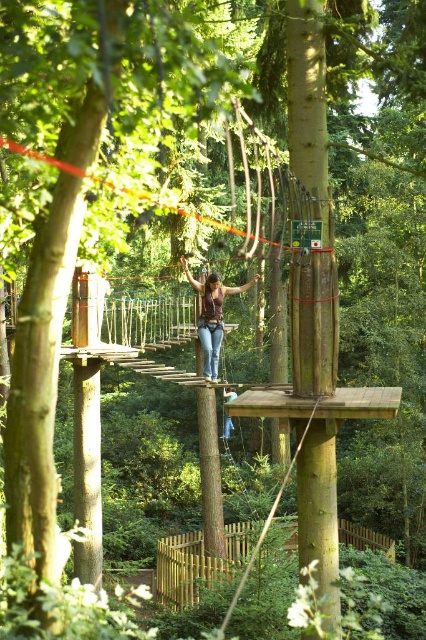
You are a participant in the obstacle course and need to cross from one platform to another. You see the denim jeans at center and the orange rope bridge at center. Which object is shorter in height?

The denim jeans at center is not as tall as the orange rope bridge at center, so the denim jeans at center is shorter in height.

You are planning to install a new safety net between the brown wooden fence at lower center and the orange rope bridge at center. Considering their heights, which object will require the safety net to be taller to cover both?

The safety net needs to be as tall as the taller object between the brown wooden fence at lower center and the orange rope bridge at center. Since the brown wooden fence at lower center is not as tall as the orange rope bridge at center, the safety net should be tall enough to accommodate the height of the orange rope bridge at center.

You are an adventurer trying to cross the orange rope bridge at center. You notice your denim jeans at center are 2.69 meters away from the bridge. Can you safely reach the bridge from your current position without moving your jeans?

The denim jeans at center are 2.69 meters away from the orange rope bridge at center. Since you are standing at the position of the denim jeans, you would need to move 2.69 meters to reach the bridge. Without moving your jeans, you cannot safely reach the bridge as you would need to cover that distance.